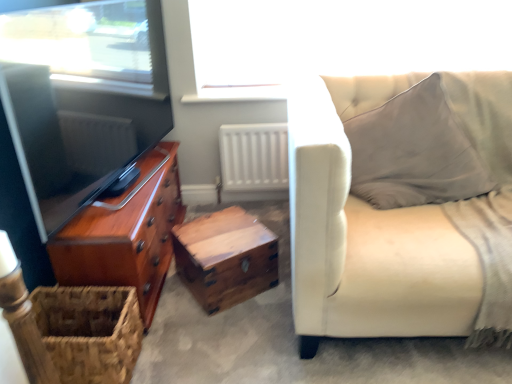
This screenshot has width=512, height=384. I want to click on vacant area in front of wooden trunk at center, so click(x=222, y=327).